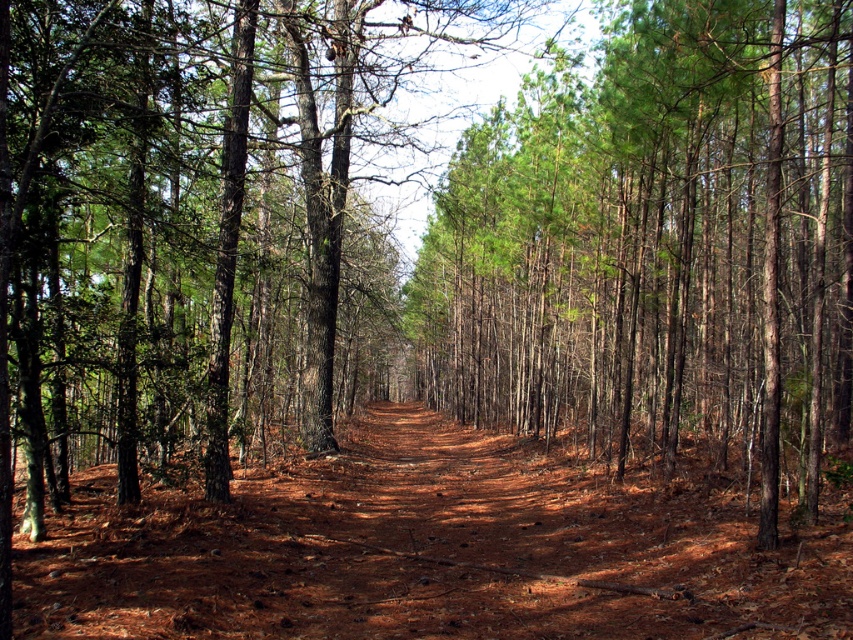
In the scene shown: Does green smooth tree at center come behind brown dirt track at center?

Yes, it is behind brown dirt track at center.

Who is positioned more to the left, green smooth tree at center or brown dirt track at center?

Positioned to the left is brown dirt track at center.

Between point (815, 342) and point (543, 586), which one is positioned behind?

The point (815, 342) is behind.

Where is `green smooth tree at center`? This screenshot has width=853, height=640. green smooth tree at center is located at coordinates (659, 244).